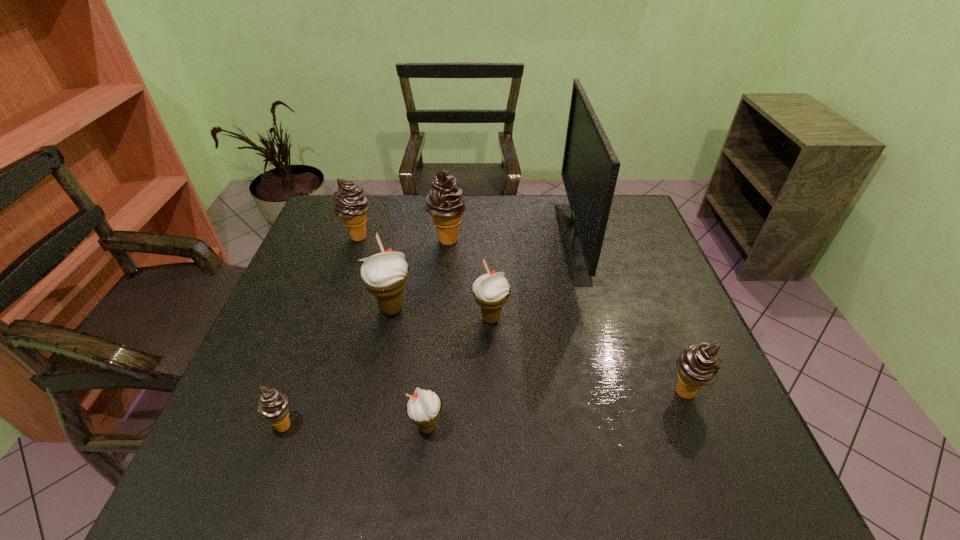
The image size is (960, 540). What are the coordinates of `the third object from right to left` in the screenshot? It's located at (491, 291).

Locate an element on the screen. the smallest white icecream is located at coordinates (423, 408).

At what (x,y) coordinates should I click in order to perform the action: click on the nearest white icecream. Please return your answer as a coordinate pair (x, y). The image size is (960, 540). Looking at the image, I should click on 423,408.

Identify the location of the smallest chocolate icecream. This screenshot has height=540, width=960. (273, 407).

At what (x,y) coordinates should I click in order to perform the action: click on vacant area located 0.240m on the front-facing side of the seventh object from left to right. Please return your answer as a coordinate pair (x, y). Looking at the image, I should click on (483, 241).

Identify the location of vacant space located 0.180m on the front-facing side of the seventh object from left to right. This screenshot has height=540, width=960. (503, 241).

Image resolution: width=960 pixels, height=540 pixels. What are the coordinates of `free spot located 0.200m on the front-facing side of the seventh object from left to right` in the screenshot? It's located at (496, 241).

Locate an element on the screen. Image resolution: width=960 pixels, height=540 pixels. free location located 0.380m on the front of the second tallest object is located at coordinates tap(437, 355).

This screenshot has width=960, height=540. Find the location of `vacant space located 0.400m on the right of the second biggest chocolate icecream`. vacant space located 0.400m on the right of the second biggest chocolate icecream is located at coordinates (504, 237).

You are a GUI agent. You are given a task and a screenshot of the screen. Output one action in this format:
    pyautogui.click(x=<x>, y=<y>)
    Task: Click on the vacant area situated 0.060m on the front of the leftmost white icecream
    
    Given the screenshot: What is the action you would take?
    pos(384,345)